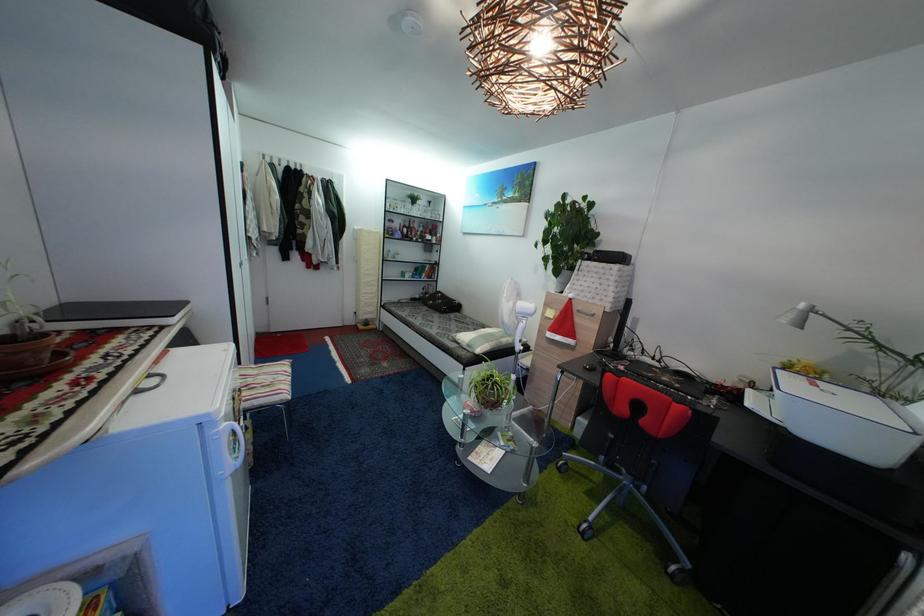
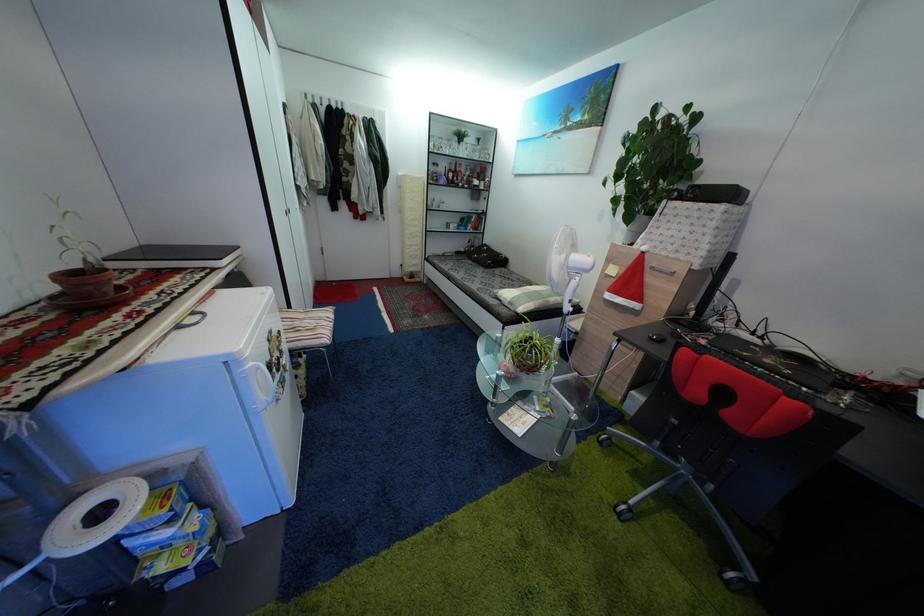
The point at (402, 229) is marked in the first image. Where is the corresponding point in the second image?

(445, 172)